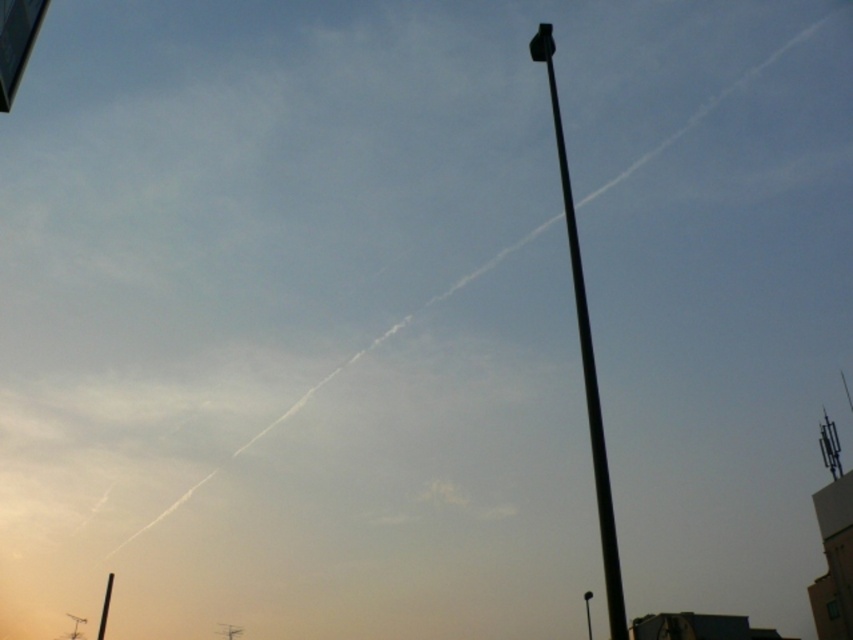
You are standing in front of the streetlight pole and looking at the two points marked in the image. Which point, point (608, 556) or point (584, 598), is closer to you?

Point (608, 556) is closer to the viewer than point (584, 598).

You are standing in the middle of the street looking at the black metal pole at upper right and the black metal pole at right. Which pole appears shorter from your vantage point?

The black metal pole at upper right appears shorter than the black metal pole at right because it has a lesser height compared to it.

You are an urban planner reviewing this cityscape image. You need to determine which object occupies more horizontal space in the frame between the black metal pole at upper right and the metallic rectangular sign at upper left. Which one is wider?

The black metal pole at upper right is wider than the metallic rectangular sign at upper left according to the description.